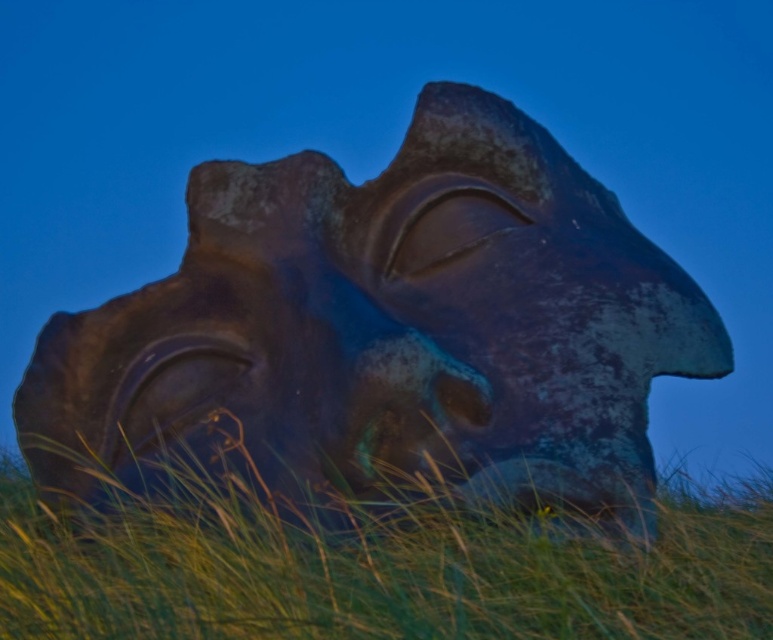
You are a gardener who needs to mow the lawn. You see the rusty stone sculpture at center and the green grass at lower center. Which object should you avoid cutting to prevent damage?

You should avoid cutting the rusty stone sculpture at center because it is positioned over the green grass at lower center, meaning the grass is the area that needs mowing while the sculpture should be left untouched.

You are standing at the base of the rusty stone sculpture at center and want to walk towards the green grass at lower center. In which direction should you head?

The rusty stone sculpture at center is to the right of green grass at lower center, so you should head to the left to reach the green grass at lower center.